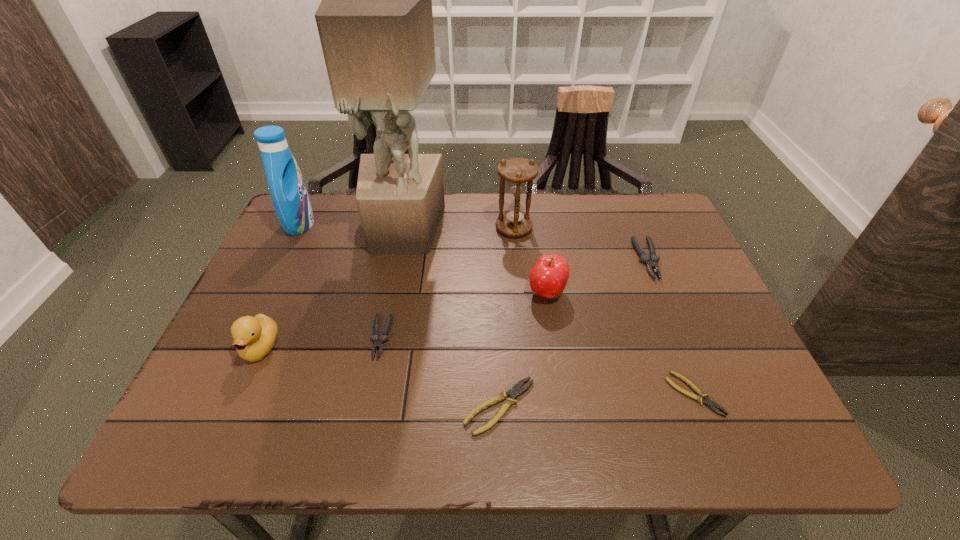
Identify which pliers is the nearest to the apple. Please provide its 2D coordinates. Your answer should be formatted as a tuple, i.e. [(x, y)], where the tuple contains the x and y coordinates of a point satisfying the conditions above.

[(515, 390)]

Choose which pliers is the nearest neighbor to the third tallest object. Please provide its 2D coordinates. Your answer should be formatted as a tuple, i.e. [(x, y)], where the tuple contains the x and y coordinates of a point satisfying the conditions above.

[(651, 262)]

Locate an element on the screen. free space that satisfies the following two spatial constraints: 1. on the front-facing side of the tallest object; 2. on the right side of the smaller yellow pliers is located at coordinates (371, 394).

Find the location of a particular element. The height and width of the screenshot is (540, 960). vacant space that satisfies the following two spatial constraints: 1. facing forward on the second pliers from left to right; 2. on the left side of the duckling is located at coordinates (235, 407).

You are a GUI agent. You are given a task and a screenshot of the screen. Output one action in this format:
    pyautogui.click(x=<x>, y=<y>)
    Task: Click on the free region that satisfies the following two spatial constraints: 1. on the front side of the third tallest object; 2. on the right side of the apple
    The height and width of the screenshot is (540, 960).
    Given the screenshot: What is the action you would take?
    pyautogui.click(x=519, y=293)